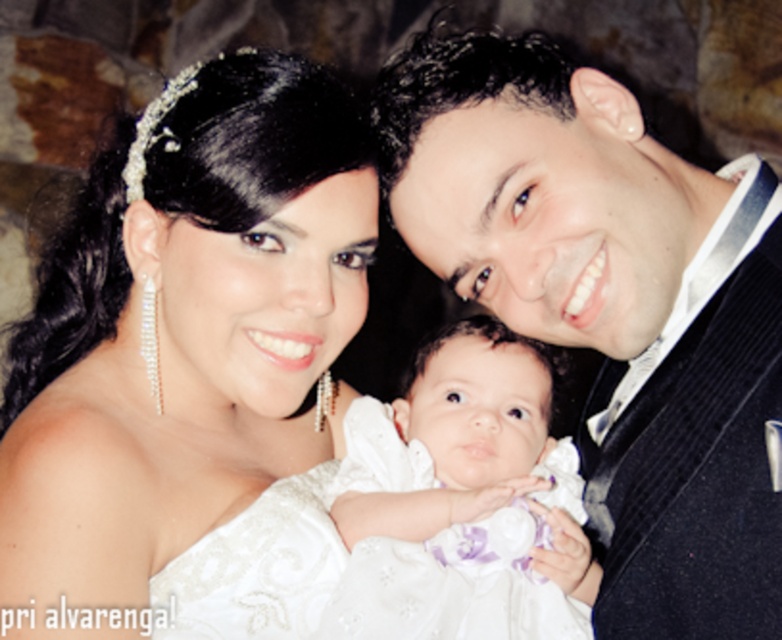
Question: Is white satin dress at upper left further to the viewer compared to white satin dress at center?

Choices:
 (A) no
 (B) yes

Answer: (A)

Question: Does white satin dress at center have a greater width compared to clear crystal tiara at upper center?

Choices:
 (A) no
 (B) yes

Answer: (B)

Question: Which point is farther from the camera taking this photo?

Choices:
 (A) (414, 476)
 (B) (689, 584)
 (C) (264, 611)
 (D) (171, 140)

Answer: (A)

Question: Estimate the real-world distances between objects in this image. Which object is farther from the white satin dress at upper left?

Choices:
 (A) white satin dress at center
 (B) satin black suit at upper right

Answer: (B)

Question: Which point is closer to the camera?

Choices:
 (A) white satin dress at center
 (B) white satin dress at upper left
 (C) satin black suit at upper right

Answer: (C)

Question: Is white satin dress at center behind clear crystal tiara at upper center?

Choices:
 (A) yes
 (B) no

Answer: (A)